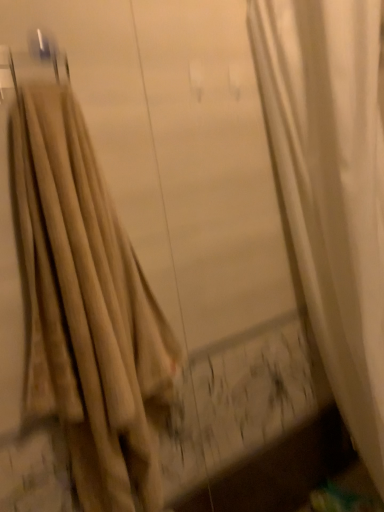
What do you see at coordinates (32, 63) in the screenshot? The width and height of the screenshot is (384, 512). I see `metallic silver hanger at upper left` at bounding box center [32, 63].

Measure the distance between metallic silver hanger at upper left and camera.

They are 28.99 inches apart.

You are a GUI agent. You are given a task and a screenshot of the screen. Output one action in this format:
    pyautogui.click(x=<x>, y=<y>)
    Task: Click on the metallic silver hanger at upper left
    This screenshot has width=384, height=512.
    Given the screenshot: What is the action you would take?
    pyautogui.click(x=32, y=63)

At what (x,y) coordinates should I click in order to perform the action: click on beige fabric curtain at left. Please return your answer as a coordinate pair (x, y). The width and height of the screenshot is (384, 512). Looking at the image, I should click on (86, 308).

Describe the element at coordinates (86, 308) in the screenshot. This screenshot has height=512, width=384. I see `beige fabric curtain at left` at that location.

I want to click on metallic silver hanger at upper left, so coord(32,63).

Based on the photo, between beige fabric curtain at left and metallic silver hanger at upper left, which one appears on the left side from the viewer's perspective?

From the viewer's perspective, metallic silver hanger at upper left appears more on the left side.

Which is in front, beige fabric curtain at left or metallic silver hanger at upper left?

beige fabric curtain at left.

Is point (120, 436) positioned in front of point (38, 52)?

That is False.

From the image's perspective, is beige fabric curtain at left below metallic silver hanger at upper left?

Indeed, from the image's perspective, beige fabric curtain at left is shown beneath metallic silver hanger at upper left.

From a real-world perspective, between beige fabric curtain at left and metallic silver hanger at upper left, who is vertically lower?

beige fabric curtain at left is physically lower.

Between beige fabric curtain at left and metallic silver hanger at upper left, which one has smaller width?

Thinner between the two is metallic silver hanger at upper left.

Is beige fabric curtain at left shorter than metallic silver hanger at upper left?

In fact, beige fabric curtain at left may be taller than metallic silver hanger at upper left.

Does beige fabric curtain at left have a larger size compared to metallic silver hanger at upper left?

Indeed, beige fabric curtain at left has a larger size compared to metallic silver hanger at upper left.

Is beige fabric curtain at left spatially inside metallic silver hanger at upper left, or outside of it?

The correct answer is: outside.

Does beige fabric curtain at left touch metallic silver hanger at upper left?

No.

Is beige fabric curtain at left aimed at metallic silver hanger at upper left?

No, beige fabric curtain at left is not oriented towards metallic silver hanger at upper left.

How many degrees apart are the facing directions of beige fabric curtain at left and metallic silver hanger at upper left?

They differ by 0.00847 degrees in their facing directions.

Measure the distance between beige fabric curtain at left and metallic silver hanger at upper left.

beige fabric curtain at left is 39.99 centimeters away from metallic silver hanger at upper left.

The width and height of the screenshot is (384, 512). I want to click on curtain in front of the metallic silver hanger at upper left, so click(86, 308).

Looking at this image, does metallic silver hanger at upper left appear on the left side of beige fabric curtain at left?

Indeed, metallic silver hanger at upper left is positioned on the left side of beige fabric curtain at left.

Relative to beige fabric curtain at left, is metallic silver hanger at upper left in front or behind?

metallic silver hanger at upper left is positioned farther from the viewer than beige fabric curtain at left.

Is point (45, 71) farther from camera compared to point (64, 143)?

That is True.

From the image's perspective, is metallic silver hanger at upper left above or below beige fabric curtain at left?

metallic silver hanger at upper left is above beige fabric curtain at left.

From a real-world perspective, relative to beige fabric curtain at left, is metallic silver hanger at upper left vertically above or below?

metallic silver hanger at upper left is situated higher than beige fabric curtain at left in the real world.

Can you confirm if metallic silver hanger at upper left is wider than beige fabric curtain at left?

No, metallic silver hanger at upper left is not wider than beige fabric curtain at left.

In the scene shown: Is metallic silver hanger at upper left taller or shorter than beige fabric curtain at left?

In the image, metallic silver hanger at upper left appears to be shorter than beige fabric curtain at left.

Does metallic silver hanger at upper left have a smaller size compared to beige fabric curtain at left?

Yes, metallic silver hanger at upper left is smaller than beige fabric curtain at left.

Would you say beige fabric curtain at left is part of metallic silver hanger at upper left's contents?

That's incorrect, beige fabric curtain at left is not inside metallic silver hanger at upper left.

Are metallic silver hanger at upper left and beige fabric curtain at left located far from each other?

No.

Is metallic silver hanger at upper left oriented towards beige fabric curtain at left?

No, metallic silver hanger at upper left does not turn towards beige fabric curtain at left.

How far apart are metallic silver hanger at upper left and beige fabric curtain at left?

They are 15.74 inches apart.

The height and width of the screenshot is (512, 384). I want to click on curtain that is in front of the metallic silver hanger at upper left, so click(x=86, y=308).

Locate an element on the screen. This screenshot has height=512, width=384. hanger on the left of the beige fabric curtain at left is located at coordinates (32, 63).

At what (x,y) coordinates should I click in order to perform the action: click on hanger positioned vertically above the beige fabric curtain at left (from a real-world perspective). Please return your answer as a coordinate pair (x, y). This screenshot has height=512, width=384. Looking at the image, I should click on (32, 63).